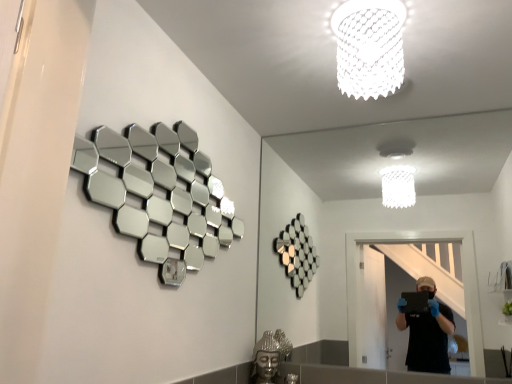
Question: From the image's perspective, is silver reflective hexagonal mirrors at upper left, the first mirror when ordered from left to right, over white textured lampshade at upper center?

Choices:
 (A) yes
 (B) no

Answer: (B)

Question: Could you tell me if silver reflective hexagonal mirrors at upper left, the first mirror when ordered from left to right, is facing white textured lampshade at upper center?

Choices:
 (A) no
 (B) yes

Answer: (B)

Question: From a real-world perspective, is silver reflective hexagonal mirrors at upper left, the first mirror when ordered from left to right, physically below white textured lampshade at upper center?

Choices:
 (A) no
 (B) yes

Answer: (B)

Question: Is silver reflective hexagonal mirrors at upper left, which is the second mirror from right to left, facing away from white textured lampshade at upper center?

Choices:
 (A) no
 (B) yes

Answer: (A)

Question: Does silver reflective hexagonal mirrors at upper left, the first mirror when ordered from left to right, appear on the right side of white textured lampshade at upper center?

Choices:
 (A) yes
 (B) no

Answer: (B)

Question: From the image's perspective, is white textured lampshade at upper center positioned above or below silver reflective hexagonal mirrors at upper left, the first mirror when ordered from left to right?

Choices:
 (A) above
 (B) below

Answer: (A)

Question: Is white textured lampshade at upper center inside or outside of silver reflective hexagonal mirrors at upper left, which is the second mirror from right to left?

Choices:
 (A) inside
 (B) outside

Answer: (B)

Question: From a real-world perspective, relative to silver reflective hexagonal mirrors at upper left, which is the second mirror from right to left, is white textured lampshade at upper center vertically above or below?

Choices:
 (A) below
 (B) above

Answer: (B)

Question: Considering the positions of point (388, 16) and point (124, 158), is point (388, 16) closer or farther from the camera than point (124, 158)?

Choices:
 (A) closer
 (B) farther

Answer: (A)

Question: Relative to clear glass mirror at center, which is the second mirror in left-to-right order, is white textured lampshade at upper center in front or behind?

Choices:
 (A) front
 (B) behind

Answer: (A)

Question: Looking at their shapes, would you say white textured lampshade at upper center is wider or thinner than clear glass mirror at center, which is the second mirror in left-to-right order?

Choices:
 (A) thin
 (B) wide

Answer: (B)

Question: Considering the positions of white textured lampshade at upper center and clear glass mirror at center, which is the second mirror in left-to-right order, in the image, is white textured lampshade at upper center taller or shorter than clear glass mirror at center, which is the second mirror in left-to-right order,?

Choices:
 (A) short
 (B) tall

Answer: (A)

Question: Does point (385, 41) appear closer or farther from the camera than point (269, 185)?

Choices:
 (A) closer
 (B) farther

Answer: (A)

Question: From the image's perspective, is silver metallic buddha head at lower center positioned above or below white textured lampshade at upper center?

Choices:
 (A) above
 (B) below

Answer: (B)

Question: Considering the relative positions of silver metallic buddha head at lower center and white textured lampshade at upper center in the image provided, is silver metallic buddha head at lower center to the left or to the right of white textured lampshade at upper center?

Choices:
 (A) left
 (B) right

Answer: (A)